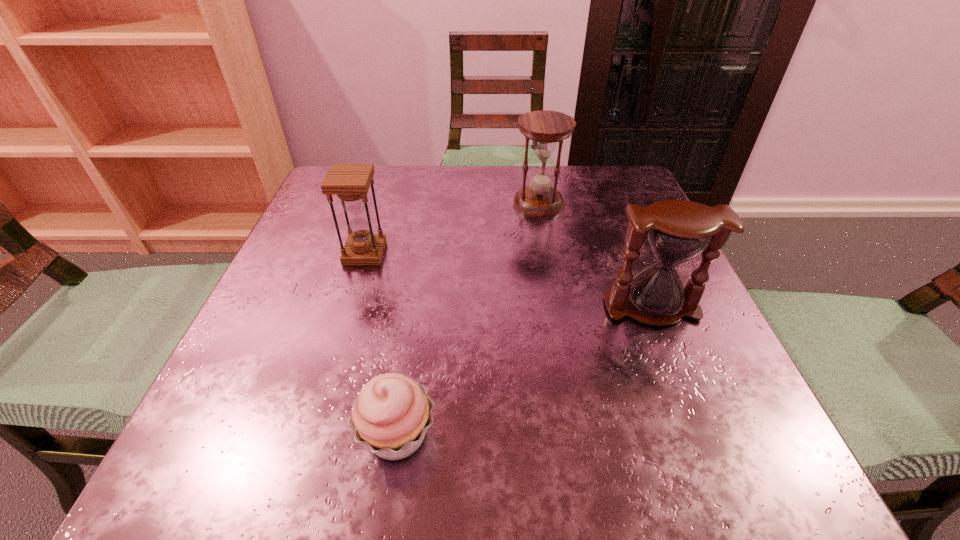
This screenshot has height=540, width=960. I want to click on blank space located on the back of the leftmost hourglass, so click(381, 201).

Locate an element on the screen. free location located 0.210m on the left of the nearest object is located at coordinates (196, 435).

The image size is (960, 540). Find the location of `object located at the far edge`. object located at the far edge is located at coordinates (545, 127).

Image resolution: width=960 pixels, height=540 pixels. I want to click on object present at the near edge, so click(x=391, y=415).

Where is `object present at the left edge`? This screenshot has width=960, height=540. object present at the left edge is located at coordinates (350, 182).

The height and width of the screenshot is (540, 960). I want to click on object at the right edge, so point(678,230).

The height and width of the screenshot is (540, 960). Find the location of `free space at the far edge of the desktop`. free space at the far edge of the desktop is located at coordinates (476, 213).

This screenshot has width=960, height=540. I want to click on free location at the near edge of the desktop, so click(615, 478).

This screenshot has width=960, height=540. Identify the location of blank area at the left edge. (294, 245).

The image size is (960, 540). In the image, there is a desktop. Find the location of `vacant region at the right edge`. vacant region at the right edge is located at coordinates (709, 342).